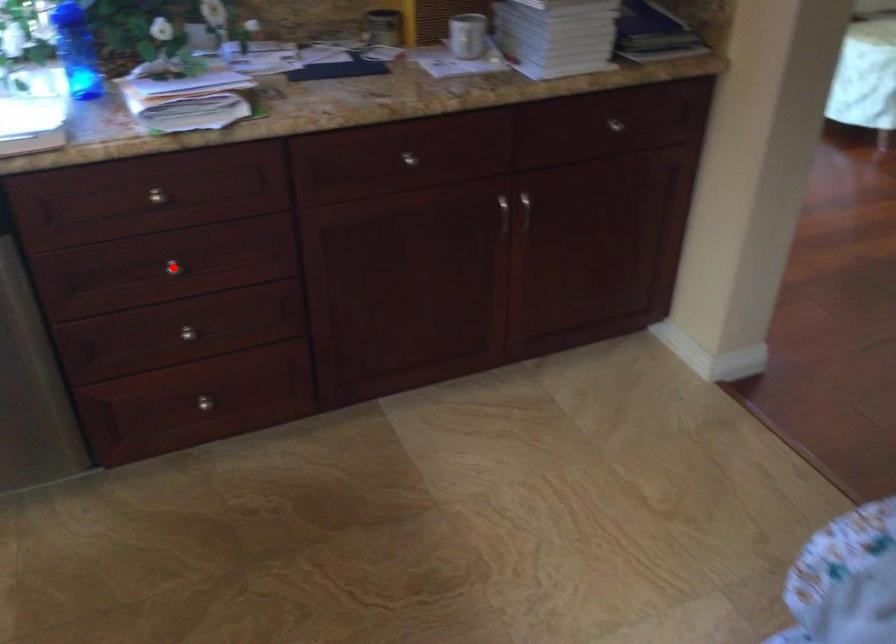
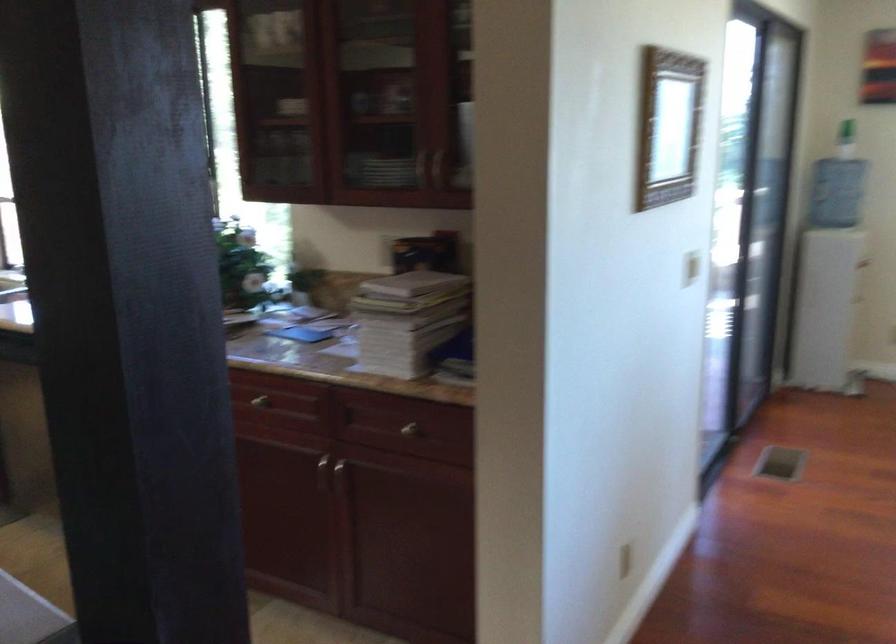
Question: I am providing you with two images of the same scene from different viewpoints. A red point is marked on the first image. Can you still see the location of the red point in image 2?

Choices:
 (A) Yes
 (B) No

Answer: (B)